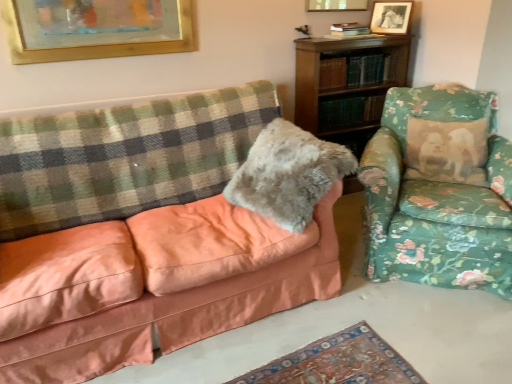
The height and width of the screenshot is (384, 512). I want to click on matte peach couch at left, so click(x=142, y=236).

This screenshot has width=512, height=384. Describe the element at coordinates (336, 5) in the screenshot. I see `wooden picture frame at upper center, the 2th picture frame from the right` at that location.

What do you see at coordinates (346, 86) in the screenshot? Image resolution: width=512 pixels, height=384 pixels. I see `wooden bookshelf at upper right` at bounding box center [346, 86].

Locate an element on the screen. This screenshot has width=512, height=384. floral fabric armchair at right is located at coordinates click(439, 191).

Between black glossy picture frame at upper right, placed as the 1th picture frame when sorted from right to left, and wooden bookshelf at upper right, which one appears on the right side from the viewer's perspective?

Positioned to the right is black glossy picture frame at upper right, placed as the 1th picture frame when sorted from right to left.

Between black glossy picture frame at upper right, placed as the 1th picture frame when sorted from right to left, and wooden bookshelf at upper right, which one has less height?

Standing shorter between the two is black glossy picture frame at upper right, placed as the 1th picture frame when sorted from right to left.

Considering the relative sizes of black glossy picture frame at upper right, placed as the 1th picture frame when sorted from right to left, and wooden bookshelf at upper right in the image provided, is black glossy picture frame at upper right, placed as the 1th picture frame when sorted from right to left, smaller than wooden bookshelf at upper right?

Indeed, black glossy picture frame at upper right, placed as the 1th picture frame when sorted from right to left, has a smaller size compared to wooden bookshelf at upper right.

Considering the sizes of objects wooden picture frame at upper center, which appears as the second picture frame when viewed from the left, and fuzzy gray pillow at center in the image provided, who is wider, wooden picture frame at upper center, which appears as the second picture frame when viewed from the left, or fuzzy gray pillow at center?

fuzzy gray pillow at center.

Consider the image. From the image's perspective, relative to fuzzy gray pillow at center, is wooden picture frame at upper center, which appears as the second picture frame when viewed from the left, above or below?

From the image's perspective, wooden picture frame at upper center, which appears as the second picture frame when viewed from the left, appears above fuzzy gray pillow at center.

From the fuzzy gray pillow at center, count 2nd picture frames backward and point to it. Please provide its 2D coordinates.

[(336, 5)]

Is the position of wooden picture frame at upper center, which appears as the second picture frame when viewed from the left, more distant than that of fuzzy gray pillow at center?

Yes, the depth of wooden picture frame at upper center, which appears as the second picture frame when viewed from the left, is greater than that of fuzzy gray pillow at center.

Based on the photo, is matte peach couch at left wider or thinner than green checkered blanket at left?

matte peach couch at left is wider than green checkered blanket at left.

Between matte peach couch at left and green checkered blanket at left, which one has larger size?

matte peach couch at left.

How different are the orientations of matte peach couch at left and green checkered blanket at left in degrees?

4.54 degrees separate the facing orientations of matte peach couch at left and green checkered blanket at left.

Image resolution: width=512 pixels, height=384 pixels. I want to click on studio couch that is on the right side of green checkered blanket at left, so (142, 236).

Based on their positions, is gold-framed picture at upper center, the first picture frame in the left-to-right sequence, located to the left or right of fuzzy gray pillow at center?

Clearly, gold-framed picture at upper center, the first picture frame in the left-to-right sequence, is on the left of fuzzy gray pillow at center in the image.

Is gold-framed picture at upper center, the first picture frame in the left-to-right sequence, positioned behind fuzzy gray pillow at center?

Yes, it is.

Could you tell me if gold-framed picture at upper center, the 3th picture frame when ordered from right to left, is facing fuzzy gray pillow at center?

No, gold-framed picture at upper center, the 3th picture frame when ordered from right to left, is not turned towards fuzzy gray pillow at center.

From a real-world perspective, is gold-framed picture at upper center, the 3th picture frame when ordered from right to left, located beneath fuzzy gray pillow at center?

No, from a real-world perspective, gold-framed picture at upper center, the 3th picture frame when ordered from right to left, is not below fuzzy gray pillow at center.

Between gold-framed picture at upper center, the 3th picture frame when ordered from right to left, and floral fabric armchair at right, which one has less height?

With less height is gold-framed picture at upper center, the 3th picture frame when ordered from right to left.

From a real-world perspective, is gold-framed picture at upper center, the 3th picture frame when ordered from right to left, located beneath floral fabric armchair at right?

No, from a real-world perspective, gold-framed picture at upper center, the 3th picture frame when ordered from right to left, is not below floral fabric armchair at right.

Does point (167, 25) appear closer or farther from the camera than point (448, 132)?

Clearly, point (167, 25) is more distant from the camera than point (448, 132).

Considering the positions of objects gold-framed picture at upper center, the first picture frame in the left-to-right sequence, and floral fabric armchair at right in the image provided, who is more to the left, gold-framed picture at upper center, the first picture frame in the left-to-right sequence, or floral fabric armchair at right?

From the viewer's perspective, gold-framed picture at upper center, the first picture frame in the left-to-right sequence, appears more on the left side.

Is wooden bookshelf at upper right placed right next to gold-framed picture at upper center, the first picture frame in the left-to-right sequence?

There is a gap between wooden bookshelf at upper right and gold-framed picture at upper center, the first picture frame in the left-to-right sequence.

What's the angular difference between wooden bookshelf at upper right and gold-framed picture at upper center, the first picture frame in the left-to-right sequence,'s facing directions?

wooden bookshelf at upper right and gold-framed picture at upper center, the first picture frame in the left-to-right sequence, are facing 0.524 degrees away from each other.

Looking at this image, would you say gold-framed picture at upper center, the first picture frame in the left-to-right sequence, is part of wooden bookshelf at upper right's contents?

No, wooden bookshelf at upper right does not contain gold-framed picture at upper center, the first picture frame in the left-to-right sequence.

From a real-world perspective, between wooden bookshelf at upper right and gold-framed picture at upper center, the 3th picture frame when ordered from right to left, who is vertically higher?

In real-world perspective, gold-framed picture at upper center, the 3th picture frame when ordered from right to left, is above.

Is point (473, 206) more distant than point (283, 167)?

Yes, it is.

Could you tell me if floral fabric armchair at right is turned towards fuzzy gray pillow at center?

No, floral fabric armchair at right is not aimed at fuzzy gray pillow at center.

Considering the relative sizes of floral fabric armchair at right and fuzzy gray pillow at center in the image provided, is floral fabric armchair at right shorter than fuzzy gray pillow at center?

Incorrect, the height of floral fabric armchair at right does not fall short of that of fuzzy gray pillow at center.

Looking at their sizes, would you say floral fabric armchair at right is wider or thinner than fuzzy gray pillow at center?

Considering their sizes, floral fabric armchair at right looks broader than fuzzy gray pillow at center.

From the image's perspective, which picture frame is the 2nd one above the wooden bookshelf at upper right? Please provide its 2D coordinates.

[(391, 17)]

Locate an element on the screen. This screenshot has width=512, height=384. picture frame that is the 2nd one when counting backward from the fuzzy gray pillow at center is located at coordinates (336, 5).

Which object lies nearer to the anchor point gold-framed picture at upper center, the 3th picture frame when ordered from right to left, matte peach couch at left or green checkered blanket at left?

Among the two, green checkered blanket at left is located nearer to gold-framed picture at upper center, the 3th picture frame when ordered from right to left.

When comparing their distances from wooden bookshelf at upper right, does wooden picture frame at upper center, which appears as the second picture frame when viewed from the left, or gold-framed picture at upper center, the 3th picture frame when ordered from right to left, seem further?

Based on the image, gold-framed picture at upper center, the 3th picture frame when ordered from right to left, appears to be further to wooden bookshelf at upper right.

From the image, which object appears to be nearer to fuzzy gray pillow at center, black glossy picture frame at upper right, placed as the 3th picture frame when sorted from left to right, or gold-framed picture at upper center, the 3th picture frame when ordered from right to left?

The object closer to fuzzy gray pillow at center is gold-framed picture at upper center, the 3th picture frame when ordered from right to left.

Looking at this image, from the image, which object appears to be nearer to wooden picture frame at upper center, which appears as the second picture frame when viewed from the left, black glossy picture frame at upper right, placed as the 1th picture frame when sorted from right to left, or green checkered blanket at left?

The object closer to wooden picture frame at upper center, which appears as the second picture frame when viewed from the left, is black glossy picture frame at upper right, placed as the 1th picture frame when sorted from right to left.

Looking at the image, which one is located further to green checkered blanket at left, black glossy picture frame at upper right, placed as the 1th picture frame when sorted from right to left, or gold-framed picture at upper center, the 3th picture frame when ordered from right to left?

The object further to green checkered blanket at left is black glossy picture frame at upper right, placed as the 1th picture frame when sorted from right to left.

When comparing their distances from gold-framed picture at upper center, the 3th picture frame when ordered from right to left, does black glossy picture frame at upper right, placed as the 3th picture frame when sorted from left to right, or matte peach couch at left seem further?

black glossy picture frame at upper right, placed as the 3th picture frame when sorted from left to right.

Looking at the image, which one is located further to wooden picture frame at upper center, which appears as the second picture frame when viewed from the left, floral fabric armchair at right or black glossy picture frame at upper right, placed as the 1th picture frame when sorted from right to left?

The object further to wooden picture frame at upper center, which appears as the second picture frame when viewed from the left, is floral fabric armchair at right.

Estimate the real-world distances between objects in this image. Which object is closer to wooden bookshelf at upper right, gold-framed picture at upper center, the 3th picture frame when ordered from right to left, or matte peach couch at left?

gold-framed picture at upper center, the 3th picture frame when ordered from right to left, lies closer to wooden bookshelf at upper right than the other object.

The height and width of the screenshot is (384, 512). What are the coordinates of `shelf positioned between fuzzy gray pillow at center and black glossy picture frame at upper right, placed as the 3th picture frame when sorted from left to right, from near to far` in the screenshot? It's located at (346, 86).

You are a GUI agent. You are given a task and a screenshot of the screen. Output one action in this format:
    pyautogui.click(x=<x>, y=<y>)
    Task: Click on the plaid between matte peach couch at left and wooden bookshelf at upper right from front to back
    Image resolution: width=512 pixels, height=384 pixels.
    Given the screenshot: What is the action you would take?
    pyautogui.click(x=125, y=157)

Locate an element on the screen. shelf between wooden picture frame at upper center, the 2th picture frame from the right, and fuzzy gray pillow at center from top to bottom is located at coordinates 346,86.

Identify the location of picture frame located between gold-framed picture at upper center, the 3th picture frame when ordered from right to left, and black glossy picture frame at upper right, placed as the 1th picture frame when sorted from right to left, in the left-right direction. (336, 5).